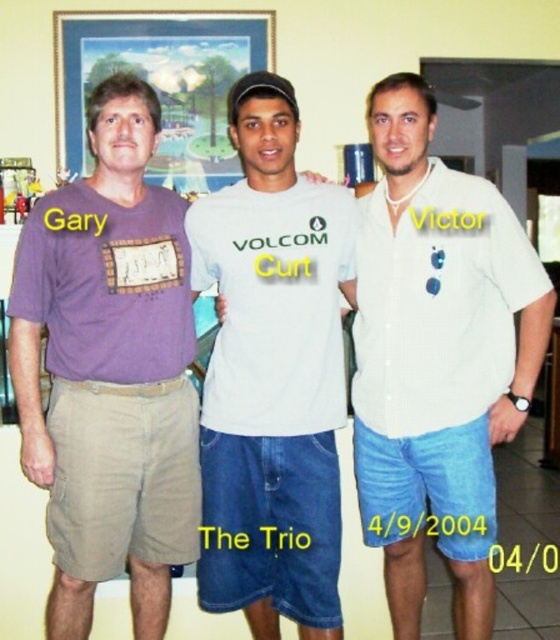
Can you confirm if white cotton shirt at center is positioned to the left of purple cotton t-shirt at left?

In fact, white cotton shirt at center is to the right of purple cotton t-shirt at left.

Is point (473, 346) in front of point (144, 195)?

Yes.

What are the coordinates of `white cotton shirt at center` in the screenshot? It's located at (437, 358).

Is white textured shirt at center smaller than wooden frame at upper center?

No.

Between point (436, 243) and point (150, 68), which one is positioned behind?

The point (150, 68) is behind.

This screenshot has height=640, width=560. I want to click on white textured shirt at center, so click(438, 304).

Image resolution: width=560 pixels, height=640 pixels. Describe the element at coordinates (274, 305) in the screenshot. I see `white matte t-shirt at center` at that location.

The image size is (560, 640). What are the coordinates of `white matte t-shirt at center` in the screenshot? It's located at (274, 305).